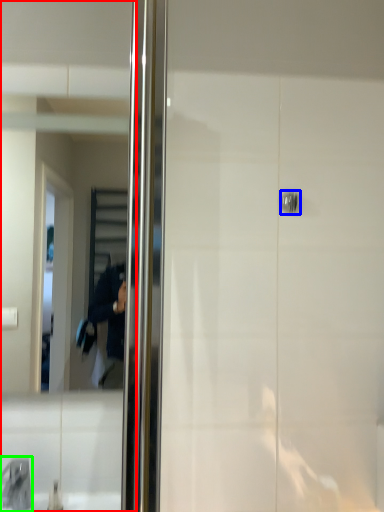
Question: Which is nearer to the mirror (highlighted by a red box)? door handle (highlighted by a blue box) or faucet (highlighted by a green box).

Choices:
 (A) door handle
 (B) faucet

Answer: (B)